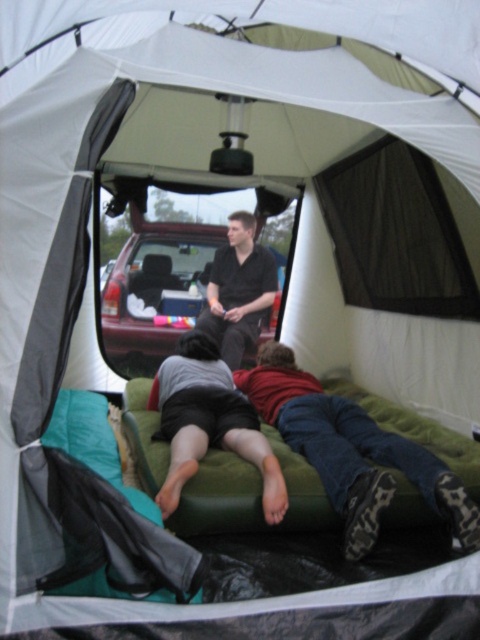
You are setting up a campsite and need to ensure that the denim jeans at lower center and the matte red car at center are visible from the tent entrance. Based on their current positions, which object would block the view of the other if someone is standing at the entrance?

The denim jeans at lower center is in front of the matte red car at center, so the denim jeans at lower center would block the view of the matte red car at center from the entrance.

You are setting up a camping scene and need to place the matte red car at center and the gray fabric shorts at center in the tent. According to the description, which object should be placed closer to the front of the tent?

The gray fabric shorts at center is behind the matte red car at center, so the matte red car at center should be placed closer to the front of the tent.